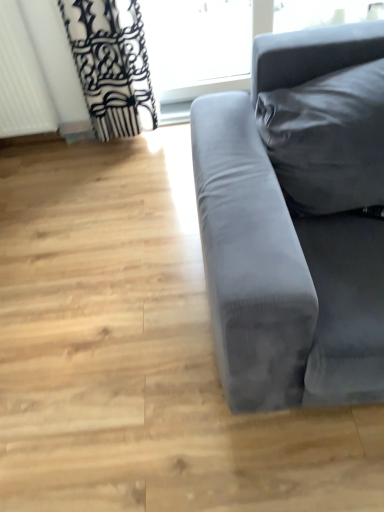
Find the location of `free spot in front of white textured radiator at left`. free spot in front of white textured radiator at left is located at coordinates (39, 155).